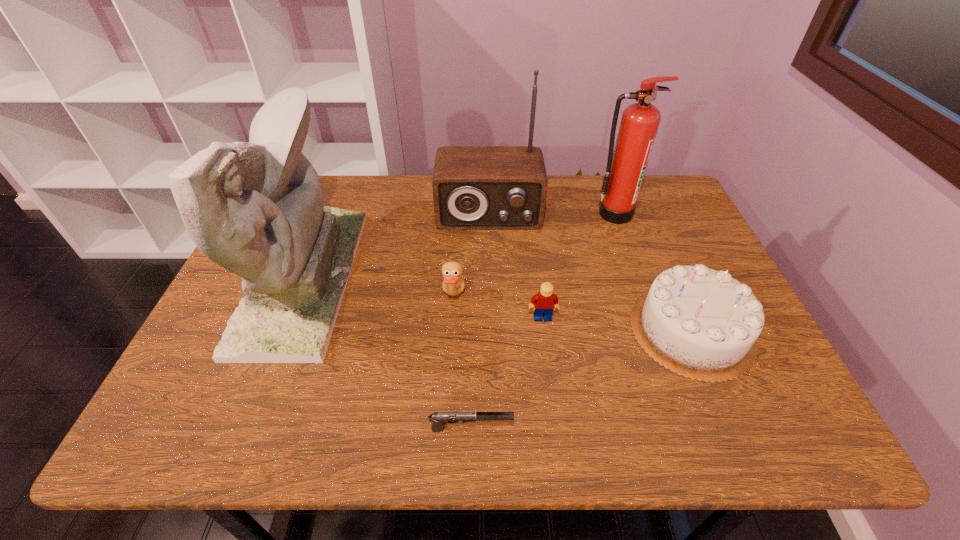
This screenshot has width=960, height=540. I want to click on sculpture, so click(257, 209).

Locate an element on the screen. This screenshot has width=960, height=540. fire extinguisher is located at coordinates (626, 166).

Where is `radio receiver`? radio receiver is located at coordinates (474, 187).

Locate an element on the screen. the fourth shortest object is located at coordinates (700, 323).

Locate an element on the screen. Lego is located at coordinates (543, 303).

The width and height of the screenshot is (960, 540). Find the location of `duck`. duck is located at coordinates (453, 283).

Where is `the shortest object`? The height and width of the screenshot is (540, 960). the shortest object is located at coordinates (439, 419).

Where is `the nearest object`? The image size is (960, 540). the nearest object is located at coordinates (439, 419).

Locate an element on the screen. This screenshot has width=960, height=540. vacant space located 0.120m on the base of the sculpture is located at coordinates (395, 279).

The image size is (960, 540). I want to click on vacant area located with the nozzle pointing from the back of the fire extinguisher, so click(625, 244).